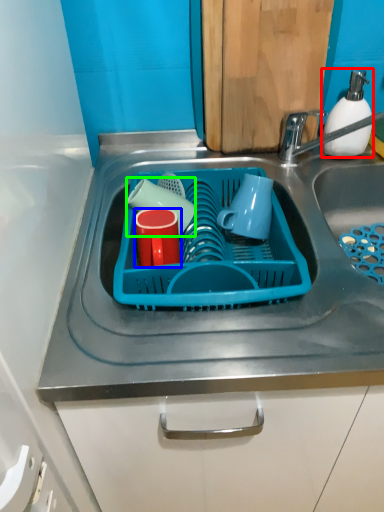
Question: Estimate the real-world distances between objects in this image. Which object is closer to soap dispenser (highlighted by a red box), tableware (highlighted by a blue box) or tableware (highlighted by a green box)?

Choices:
 (A) tableware
 (B) tableware

Answer: (B)